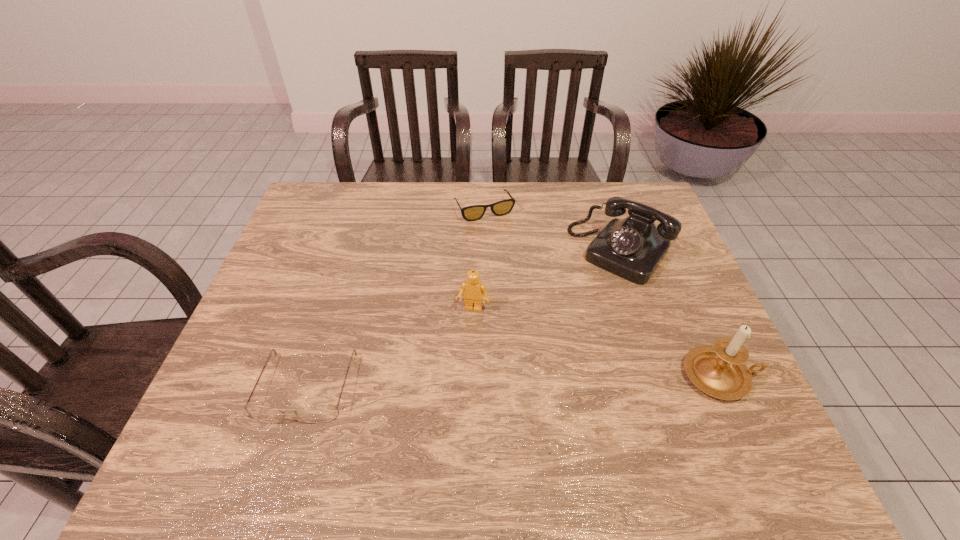
Select which object appears as the third closest to the telephone. Please provide its 2D coordinates. Your answer should be formatted as a tuple, i.e. [(x, y)], where the tuple contains the x and y coordinates of a point satisfying the conditions above.

[(473, 289)]

Image resolution: width=960 pixels, height=540 pixels. What are the coordinates of `the second closest object relative to the sunglasses` in the screenshot? It's located at (473, 289).

The image size is (960, 540). I want to click on vacant point that satisfies the following two spatial constraints: 1. on the front side of the telephone; 2. with a handle on the side of the candle holder, so click(661, 376).

You are a GUI agent. You are given a task and a screenshot of the screen. Output one action in this format:
    pyautogui.click(x=<x>, y=<y>)
    Task: Click on the vacant space that satisfies the following two spatial constraints: 1. on the front side of the sunglasses; 2. on the right side of the telephone
    This screenshot has height=540, width=960.
    Given the screenshot: What is the action you would take?
    pyautogui.click(x=485, y=252)